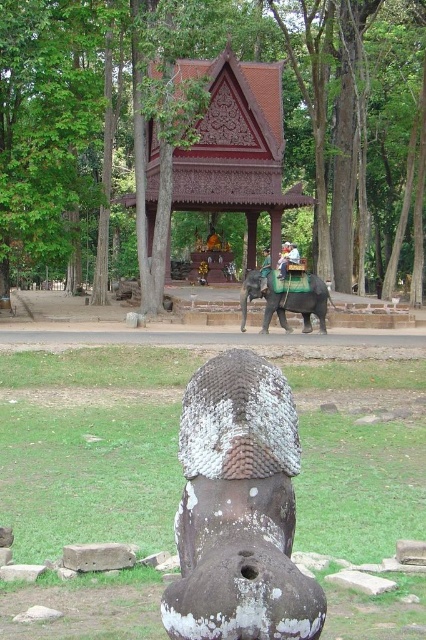
Question: Is white textured stone head at center below carved wood gazebo at center?

Choices:
 (A) yes
 (B) no

Answer: (A)

Question: Among these points, which one is nearest to the camera?

Choices:
 (A) (291, 246)
 (B) (199, 170)
 (C) (305, 134)
 (D) (284, 291)

Answer: (D)

Question: Does brown wood tree at center come behind carved wood gazebo at center?

Choices:
 (A) yes
 (B) no

Answer: (B)

Question: Which point appears farthest from the camera in this image?

Choices:
 (A) (207, 106)
 (B) (296, 618)

Answer: (A)

Question: Observing the image, what is the correct spatial positioning of carved wood gazebo at center in reference to white cloth-covered person at center?

Choices:
 (A) below
 (B) above

Answer: (B)

Question: Which point appears farthest from the camera in this image?

Choices:
 (A) (273, 204)
 (B) (356, 92)
 (C) (268, 269)

Answer: (B)